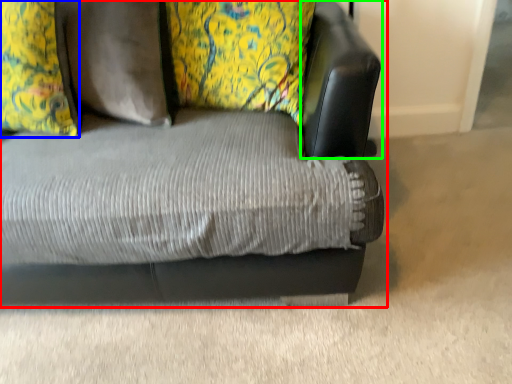
Question: Which is nearer to the studio couch (highlighted by a red box)? pillow (highlighted by a blue box) or swivel chair (highlighted by a green box).

Choices:
 (A) pillow
 (B) swivel chair

Answer: (B)